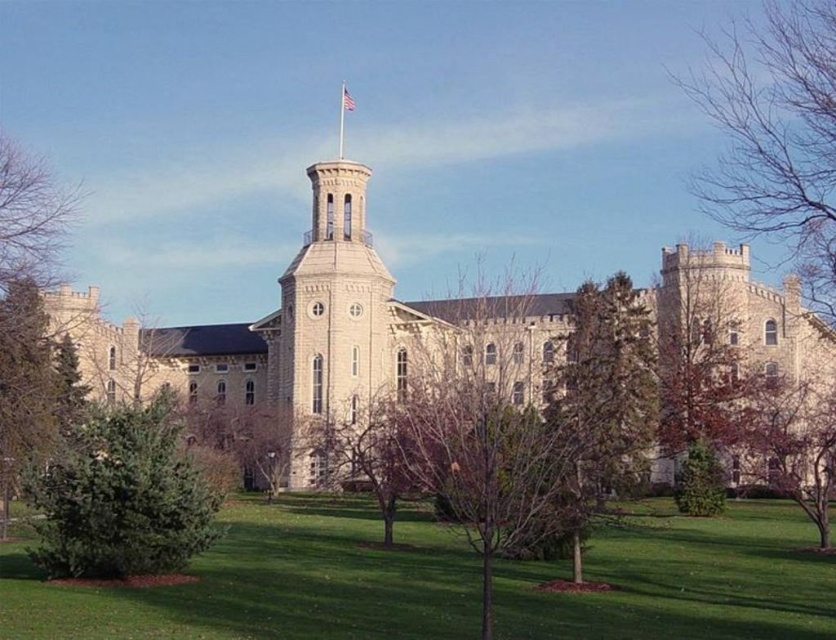
Question: Does bare branches at center appear over green leafy tree at center?

Choices:
 (A) no
 (B) yes

Answer: (A)

Question: Where is beige stone church at center located in relation to bare branches at center in the image?

Choices:
 (A) below
 (B) above

Answer: (B)

Question: Which object is farther from the camera taking this photo?

Choices:
 (A) green leafy tree at center
 (B) brown textured tree at right
 (C) bare branches at center
 (D) bare branches at upper right

Answer: (B)

Question: Does beige stone tower at center appear under green textured tree at lower right?

Choices:
 (A) yes
 (B) no

Answer: (B)

Question: Which object appears farthest from the camera in this image?

Choices:
 (A) green textured tree at lower right
 (B) purple-barked tree at center
 (C) bare branches at center

Answer: (A)

Question: Among these points, which one is farthest from the camera?

Choices:
 (A) (386, 412)
 (B) (335, 401)
 (C) (222, 474)
 (D) (788, 58)

Answer: (A)